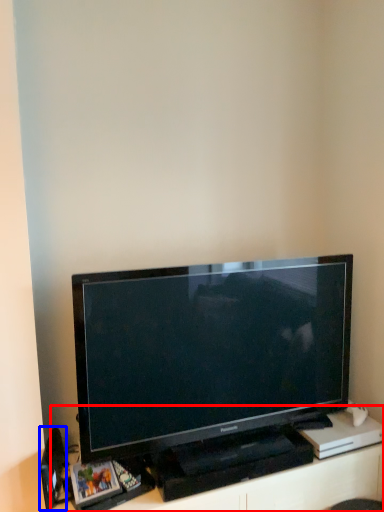
Question: Which point is closer to the camera, entertainment center (highlighted by a red box) or speaker (highlighted by a blue box)?

Choices:
 (A) entertainment center
 (B) speaker

Answer: (A)